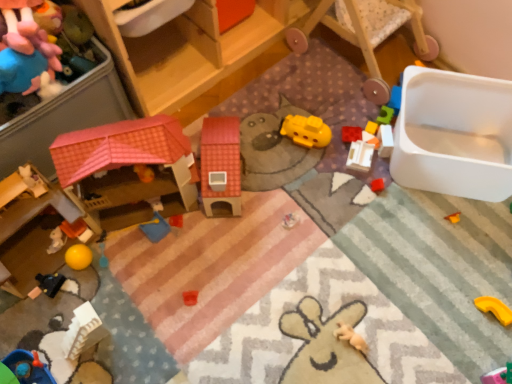
Find the location of `wooden rocking chair at upper right`. wooden rocking chair at upper right is located at coordinates (348, 41).

Find the location of a particular element. The width and height of the screenshot is (512, 384). yellow matte block at upper right, positioned as the 3th toy in right-to-left order is located at coordinates (371, 127).

Image resolution: width=512 pixels, height=384 pixels. Identify the location of wooden dollhouse at upper left. (188, 60).

Locate an element on the screen. The width and height of the screenshot is (512, 384). matte plastic dollhouse at center-left, acting as the eighth toy starting from the right is located at coordinates (127, 169).

The image size is (512, 384). What are the coordinates of `white plastic building at center-right, positioned as the 4th toy in right-to-left order` in the screenshot? It's located at (360, 156).

At what (x,y) coordinates should I click in order to perform the action: click on wooden rocking chair at upper right. Please return your answer as a coordinate pair (x, y). The height and width of the screenshot is (384, 512). Looking at the image, I should click on (348, 41).

Which object is closer to the camera, matte plastic dollhouse at center-left, the fourth toy viewed from the left, or light brown plush toy at lower right, which appears as the 6th toy when viewed from the left?

matte plastic dollhouse at center-left, the fourth toy viewed from the left, is more forward.

Who is shorter, matte plastic dollhouse at center-left, acting as the eighth toy starting from the right, or light brown plush toy at lower right, which appears as the 6th toy when viewed from the left?

With less height is light brown plush toy at lower right, which appears as the 6th toy when viewed from the left.

From the image's perspective, is matte plastic dollhouse at center-left, acting as the eighth toy starting from the right, beneath light brown plush toy at lower right, the sixth toy from the right?

No, from the image's perspective, matte plastic dollhouse at center-left, acting as the eighth toy starting from the right, is not below light brown plush toy at lower right, the sixth toy from the right.

In the scene shown: Is white plastic building at center-right, positioned as the 4th toy in right-to-left order, to the left or to the right of white plastic blocks at right, placed as the tenth toy when sorted from left to right, in the image?

In the image, white plastic building at center-right, positioned as the 4th toy in right-to-left order, appears on the left side of white plastic blocks at right, placed as the tenth toy when sorted from left to right.

Is white plastic building at center-right, the eighth toy when ordered from left to right, spatially inside white plastic blocks at right, placed as the tenth toy when sorted from left to right, or outside of it?

white plastic building at center-right, the eighth toy when ordered from left to right, cannot be found inside white plastic blocks at right, placed as the tenth toy when sorted from left to right.

Consider the image. Considering the sizes of objects white plastic building at center-right, the eighth toy when ordered from left to right, and white plastic blocks at right, which is the second toy in right-to-left order, in the image provided, who is thinner, white plastic building at center-right, the eighth toy when ordered from left to right, or white plastic blocks at right, which is the second toy in right-to-left order,?

Thinner between the two is white plastic blocks at right, which is the second toy in right-to-left order.

Does white plastic building at center-right, the eighth toy when ordered from left to right, have a lesser height compared to white plastic blocks at right, which is the second toy in right-to-left order?

Indeed, white plastic building at center-right, the eighth toy when ordered from left to right, has a lesser height compared to white plastic blocks at right, which is the second toy in right-to-left order.

Is black matte toy car at lower left, arranged as the 2th toy when viewed from the left, oriented towards wooden dollhouse at upper left?

No, black matte toy car at lower left, arranged as the 2th toy when viewed from the left, is not facing towards wooden dollhouse at upper left.

Can you confirm if black matte toy car at lower left, arranged as the 2th toy when viewed from the left, is positioned to the left of wooden dollhouse at upper left?

Yes, black matte toy car at lower left, arranged as the 2th toy when viewed from the left, is to the left of wooden dollhouse at upper left.

The image size is (512, 384). I want to click on furniture that appears above the black matte toy car at lower left, the tenth toy viewed from the right (from a real-world perspective), so click(188, 60).

Does point (51, 284) lie in front of point (145, 38)?

Yes, it is in front of point (145, 38).

Considering their positions, is white plastic blocks at right, placed as the tenth toy when sorted from left to right, located in front of or behind yellow rubber toy at lower right, which ranks as the 1th toy in right-to-left order?

white plastic blocks at right, placed as the tenth toy when sorted from left to right, is behind yellow rubber toy at lower right, which ranks as the 1th toy in right-to-left order.

In the image, is white plastic blocks at right, placed as the tenth toy when sorted from left to right, on the left side or the right side of yellow rubber toy at lower right, positioned as the 11th toy in left-to-right order?

white plastic blocks at right, placed as the tenth toy when sorted from left to right, is positioned on yellow rubber toy at lower right, positioned as the 11th toy in left-to-right order,'s left side.

Looking at this image, is white plastic blocks at right, which is the second toy in right-to-left order, shorter than yellow rubber toy at lower right, positioned as the 11th toy in left-to-right order?

In fact, white plastic blocks at right, which is the second toy in right-to-left order, may be taller than yellow rubber toy at lower right, positioned as the 11th toy in left-to-right order.

Considering the relative sizes of rubber brick at upper right, which appears as the fifth toy when viewed from the right, and blue fabric toy at center, arranged as the third toy when viewed from the left, in the image provided, is rubber brick at upper right, which appears as the fifth toy when viewed from the right, shorter than blue fabric toy at center, arranged as the third toy when viewed from the left,?

Yes.

Between rubber brick at upper right, placed as the 7th toy when sorted from left to right, and blue fabric toy at center, arranged as the third toy when viewed from the left, which one has larger size?

blue fabric toy at center, arranged as the third toy when viewed from the left, is bigger.

Is blue fabric toy at center, arranged as the third toy when viewed from the left, located within rubber brick at upper right, placed as the 7th toy when sorted from left to right?

No, blue fabric toy at center, arranged as the third toy when viewed from the left, is not inside rubber brick at upper right, placed as the 7th toy when sorted from left to right.

From a real-world perspective, is wooden rocking chair at upper right physically located above or below yellow rubber toy at lower right, which ranks as the 1th toy in right-to-left order?

From a real-world perspective, wooden rocking chair at upper right is physically above yellow rubber toy at lower right, which ranks as the 1th toy in right-to-left order.

Considering the sizes of wooden rocking chair at upper right and yellow rubber toy at lower right, positioned as the 11th toy in left-to-right order, in the image, is wooden rocking chair at upper right wider or thinner than yellow rubber toy at lower right, positioned as the 11th toy in left-to-right order,?

wooden rocking chair at upper right is wider than yellow rubber toy at lower right, positioned as the 11th toy in left-to-right order.

Is the depth of wooden rocking chair at upper right greater than that of yellow rubber toy at lower right, which ranks as the 1th toy in right-to-left order?

No, wooden rocking chair at upper right is in front of yellow rubber toy at lower right, which ranks as the 1th toy in right-to-left order.

The image size is (512, 384). In order to click on the 10th toy positioned below the wooden rocking chair at upper right (from the image's perspective) in this screenshot , I will do `click(494, 308)`.

In terms of width, does matte plastic dollhouse at center-left, acting as the eighth toy starting from the right, look wider or thinner when compared to yellow rubber toy at lower right, positioned as the 11th toy in left-to-right order?

Clearly, matte plastic dollhouse at center-left, acting as the eighth toy starting from the right, has more width compared to yellow rubber toy at lower right, positioned as the 11th toy in left-to-right order.

This screenshot has width=512, height=384. What are the coordinates of `the 7th toy to the left of the yellow rubber toy at lower right, which ranks as the 1th toy in right-to-left order, starting your count from the anchor` in the screenshot? It's located at (127, 169).

From a real-world perspective, is matte plastic dollhouse at center-left, acting as the eighth toy starting from the right, beneath yellow rubber toy at lower right, which ranks as the 1th toy in right-to-left order?

No, from a real-world perspective, matte plastic dollhouse at center-left, acting as the eighth toy starting from the right, is not under yellow rubber toy at lower right, which ranks as the 1th toy in right-to-left order.

The height and width of the screenshot is (384, 512). I want to click on the 5th toy located above the light brown plush toy at lower right, which appears as the 6th toy when viewed from the left (from a real-world perspective), so click(x=127, y=169).

The height and width of the screenshot is (384, 512). In order to click on toy that is the 1st object located in front of the white plastic blocks at right, which is the second toy in right-to-left order in this screenshot , I will do `click(360, 156)`.

From the image, which object appears to be nearer to rubber brick at upper right, placed as the 7th toy when sorted from left to right, yellow matte block at upper right, the ninth toy when ordered from left to right, or matte plastic dollhouse at center-left, acting as the eighth toy starting from the right?

yellow matte block at upper right, the ninth toy when ordered from left to right, is closer to rubber brick at upper right, placed as the 7th toy when sorted from left to right.

Based on their spatial positions, is rubber brick at upper right, which appears as the fifth toy when viewed from the right, or light brown plush toy at lower right, the sixth toy from the right, further from white plastic blocks at right, placed as the tenth toy when sorted from left to right?

Among the two, light brown plush toy at lower right, the sixth toy from the right, is located further to white plastic blocks at right, placed as the tenth toy when sorted from left to right.

When comparing their distances from yellow matte block at upper right, positioned as the 3th toy in right-to-left order, does rubber brick at upper right, placed as the 7th toy when sorted from left to right, or light brown plush toy at lower right, the sixth toy from the right, seem closer?

Based on the image, rubber brick at upper right, placed as the 7th toy when sorted from left to right, appears to be nearer to yellow matte block at upper right, positioned as the 3th toy in right-to-left order.

Looking at the image, which one is located further to fluffy pink plush at upper left, which is the 11th toy in right-to-left order, matte plastic dollhouse at center-left, the fourth toy viewed from the left, or wooden rocking chair at upper right?

wooden rocking chair at upper right is positioned further to the anchor fluffy pink plush at upper left, which is the 11th toy in right-to-left order.

Which object lies further to the anchor point fluffy pink plush at upper left, the 1th toy viewed from the left, wooden rocking chair at upper right or yellow rubber toy at lower right, which ranks as the 1th toy in right-to-left order?

Based on the image, yellow rubber toy at lower right, which ranks as the 1th toy in right-to-left order, appears to be further to fluffy pink plush at upper left, the 1th toy viewed from the left.

Looking at the image, which one is located closer to light brown plush toy at lower right, which appears as the 6th toy when viewed from the left, yellow rubber toy at lower right, which ranks as the 1th toy in right-to-left order, or yellow matte block at upper right, positioned as the 3th toy in right-to-left order?

The object closer to light brown plush toy at lower right, which appears as the 6th toy when viewed from the left, is yellow rubber toy at lower right, which ranks as the 1th toy in right-to-left order.

In the scene shown: Looking at the image, which one is located closer to yellow rubber toy at lower right, positioned as the 11th toy in left-to-right order, white plastic blocks at right, placed as the tenth toy when sorted from left to right, or fluffy pink plush at upper left, which is the 11th toy in right-to-left order?

The object closer to yellow rubber toy at lower right, positioned as the 11th toy in left-to-right order, is white plastic blocks at right, placed as the tenth toy when sorted from left to right.

Considering their positions, is light brown plush toy at lower right, the sixth toy from the right, positioned further to blue fabric toy at center, acting as the ninth toy starting from the right, than yellow rubber toy at lower right, which ranks as the 1th toy in right-to-left order?

yellow rubber toy at lower right, which ranks as the 1th toy in right-to-left order, lies further to blue fabric toy at center, acting as the ninth toy starting from the right, than the other object.

Identify the location of rocking chair between blue fabric toy at center, arranged as the third toy when viewed from the left, and yellow matte block at upper right, positioned as the 3th toy in right-to-left order, in the horizontal direction. The image size is (512, 384). (348, 41).

Identify the location of rocking chair between wooden dollhouse at upper left and blue fabric toy at center, arranged as the third toy when viewed from the left, from top to bottom. (348, 41).

The width and height of the screenshot is (512, 384). Find the location of `toy between matte plastic dollhouse at center-left, the fourth toy viewed from the left, and black matte toy car at lower left, the tenth toy viewed from the right, from top to bottom`. toy between matte plastic dollhouse at center-left, the fourth toy viewed from the left, and black matte toy car at lower left, the tenth toy viewed from the right, from top to bottom is located at coordinates (155, 228).

Where is `rocking chair located between blue fabric toy at center, acting as the ninth toy starting from the right, and white plastic blocks at right, placed as the tenth toy when sorted from left to right, in the left-right direction`? This screenshot has width=512, height=384. rocking chair located between blue fabric toy at center, acting as the ninth toy starting from the right, and white plastic blocks at right, placed as the tenth toy when sorted from left to right, in the left-right direction is located at coordinates (348, 41).